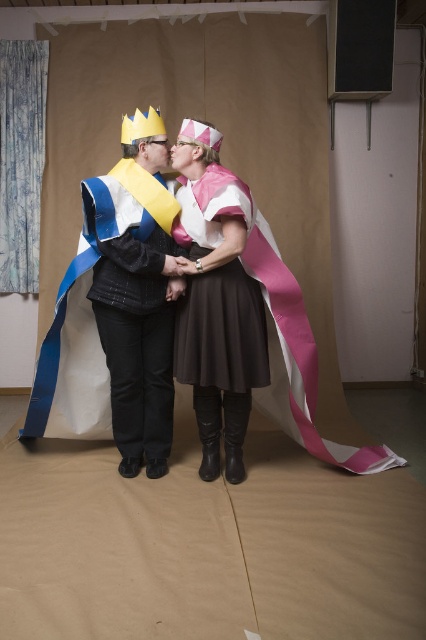
Question: Which point is farther to the camera?

Choices:
 (A) pink satin cape at center
 (B) matte black jacket at center

Answer: (B)

Question: Is pink satin cape at center to the right of matte black jacket at center from the viewer's perspective?

Choices:
 (A) no
 (B) yes

Answer: (B)

Question: Among these objects, which one is farthest from the camera?

Choices:
 (A) pink satin cape at center
 (B) matte black jacket at center

Answer: (B)

Question: Among these points, which one is nearest to the camera?

Choices:
 (A) (175, 253)
 (B) (221, 397)

Answer: (A)

Question: Is pink satin cape at center smaller than matte black jacket at center?

Choices:
 (A) no
 (B) yes

Answer: (A)

Question: In this image, where is pink satin cape at center located relative to matte black jacket at center?

Choices:
 (A) left
 (B) right

Answer: (B)